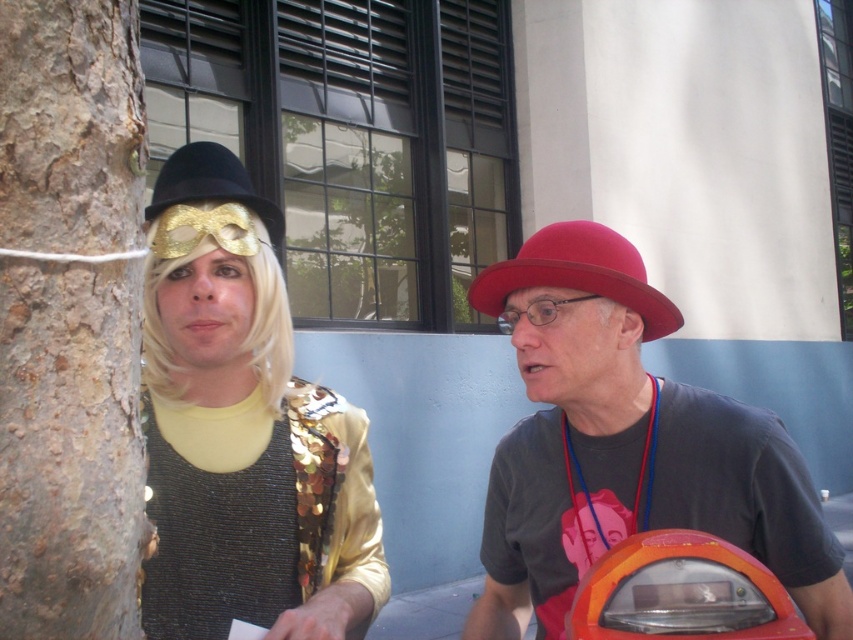
Question: Which of the following is the farthest from the observer?

Choices:
 (A) (572, 232)
 (B) (157, 524)
 (C) (572, 538)
 (D) (155, 216)

Answer: (C)

Question: Which object is closer to the camera taking this photo?

Choices:
 (A) shiny gold sequin vest at left
 (B) velvet red hat at center

Answer: (A)

Question: Is velvet red hat at center to the right of gold sequined hat at upper left from the viewer's perspective?

Choices:
 (A) no
 (B) yes

Answer: (B)

Question: Is smooth bark tree trunk at left thinner than matte red hat at center?

Choices:
 (A) yes
 (B) no

Answer: (A)

Question: From the image, what is the correct spatial relationship of orange plastic parking meter at lower right in relation to velvet red hat at center?

Choices:
 (A) right
 (B) left

Answer: (A)

Question: Based on their relative distances, which object is nearer to the matte red hat at center?

Choices:
 (A) smooth bark tree trunk at left
 (B) velvet red hat at center

Answer: (B)